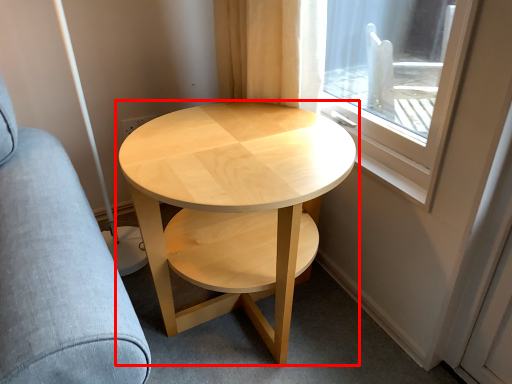
Question: From the image's perspective, what is the correct spatial relationship of coffee table (annotated by the red box) in relation to swivel chair?

Choices:
 (A) below
 (B) above

Answer: (A)